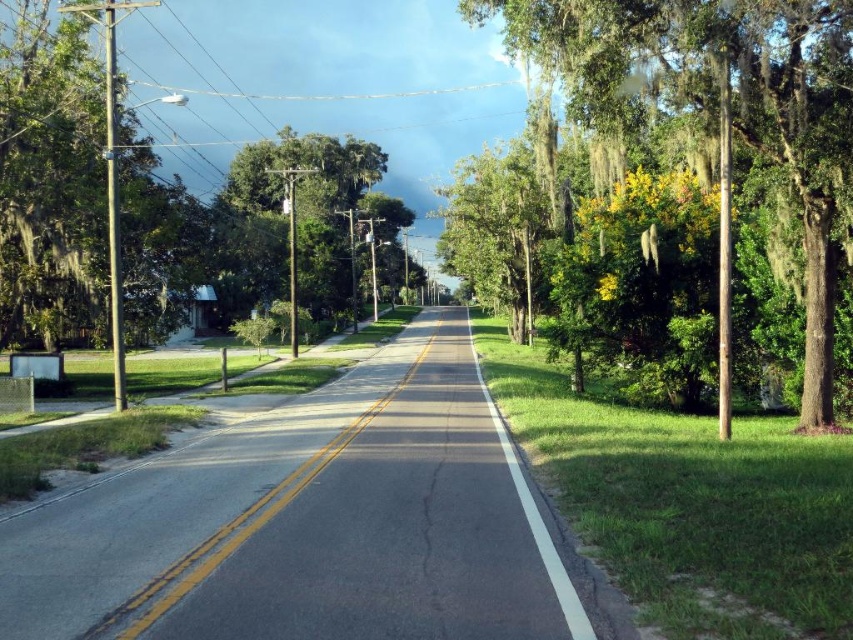
You are standing at the starting point of the road and want to walk to the green leafy tree at right. Which direction should you head towards?

The green leafy tree at right is located at point (730, 116), so you should head towards the right side of the road to reach it.

You are a hiker standing on the road and looking towards the horizon. Which of the two trees, the green leafy tree at right or the green leafy tree at center, appears closer to you?

The green leafy tree at right is below the green leafy tree at center, which means it is closer to you.